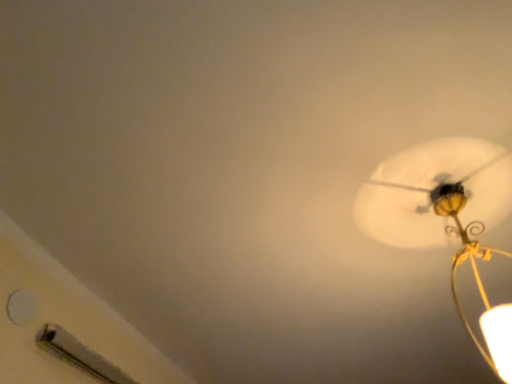
Measure the distance between matte gold lamp at upper right and camera.

The distance of matte gold lamp at upper right from camera is 31.15 inches.

What are the coordinates of `matte gold lamp at upper right` in the screenshot? It's located at (446, 216).

Describe the element at coordinates (446, 216) in the screenshot. I see `matte gold lamp at upper right` at that location.

Identify the location of matte gold lamp at upper right. (446, 216).